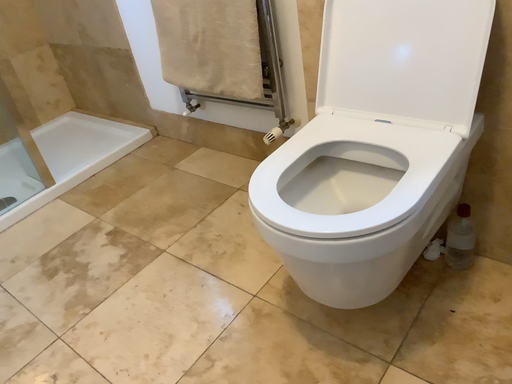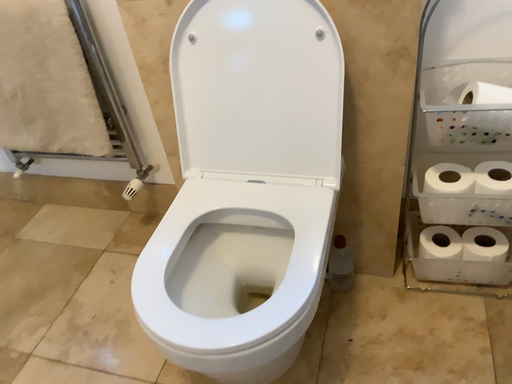
Question: How did the camera likely rotate when shooting the video?

Choices:
 (A) rotated right
 (B) rotated left

Answer: (A)